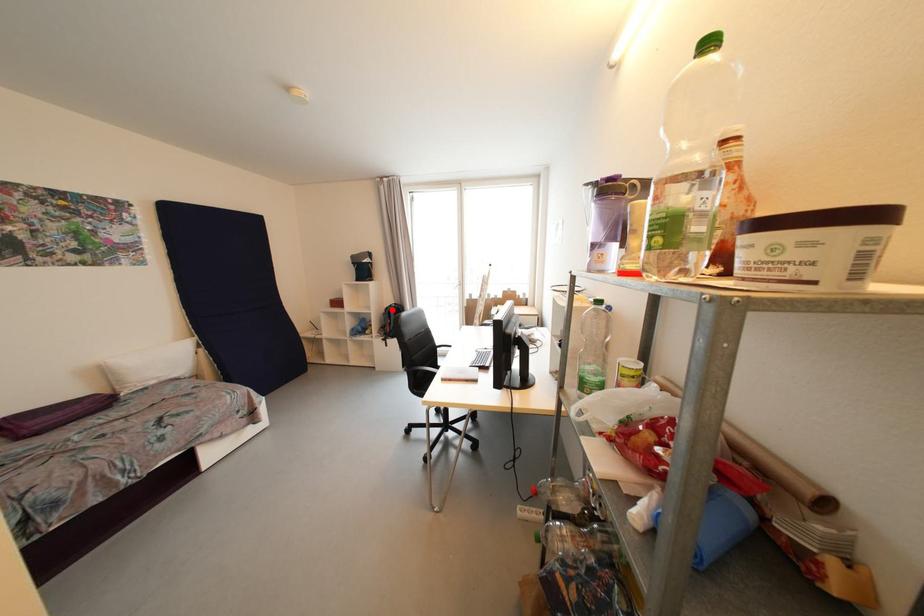
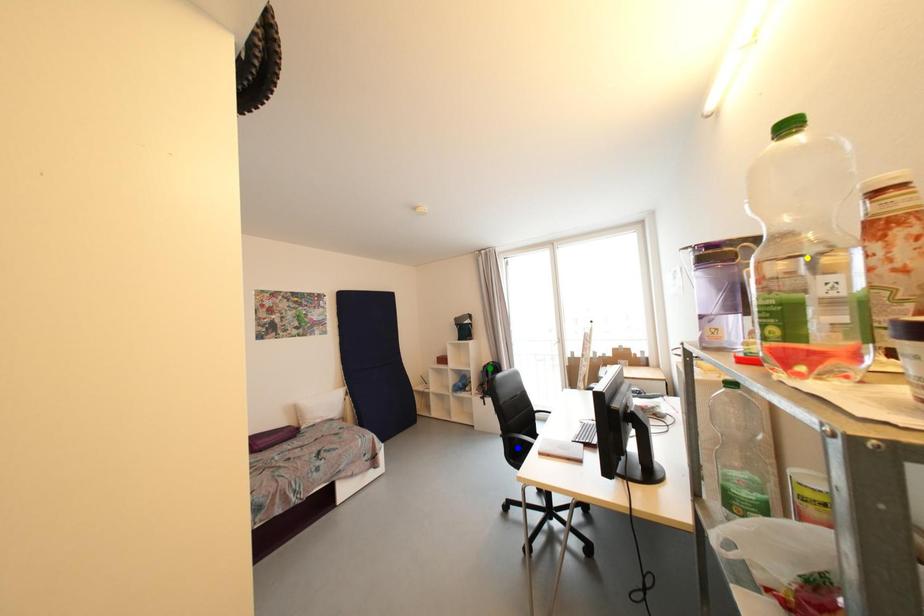
Question: I am providing you with two images of the same scene from different viewpoints. A red point is marked on the first image. You are given multiple points on the second image. In image 2, which mark is for the same physical point as the one in image 1?

Choices:
 (A) green point
 (B) yellow point
 (C) blue point

Answer: (A)